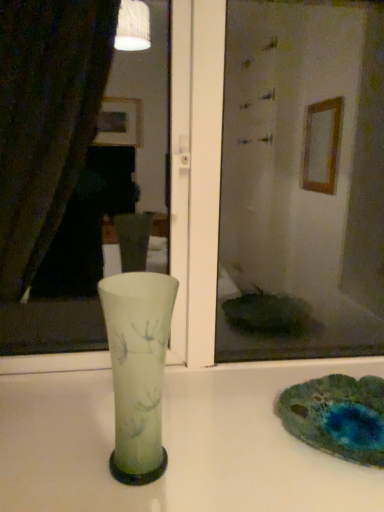
Question: From the image's perspective, is transparent glass mirror at center positioned above or below frosted glass vase at center?

Choices:
 (A) above
 (B) below

Answer: (A)

Question: Is transparent glass mirror at center taller or shorter than frosted glass vase at center?

Choices:
 (A) short
 (B) tall

Answer: (B)

Question: Which object is the closest to the white glossy vase at center?

Choices:
 (A) transparent glass mirror at center
 (B) frosted glass vase at center

Answer: (B)

Question: Based on their relative distances, which object is farther from the transparent glass mirror at center?

Choices:
 (A) white glossy vase at center
 (B) frosted glass vase at center

Answer: (B)